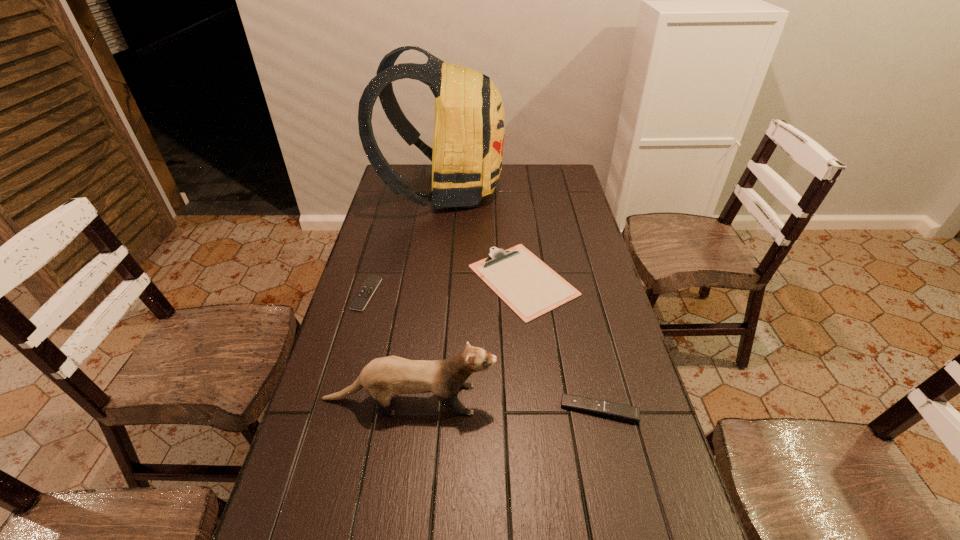
In order to click on vacant space at the far edge of the desktop in this screenshot , I will do `click(524, 187)`.

In the image, there is a desktop. Find the location of `vacant space at the left edge`. vacant space at the left edge is located at coordinates (378, 234).

Where is `blank area at the right edge`? blank area at the right edge is located at coordinates (670, 480).

Where is `vacant space at the far right corner of the desktop`? vacant space at the far right corner of the desktop is located at coordinates (556, 171).

At what (x,y) coordinates should I click in order to perform the action: click on empty space between the clipboard and the ferret. Please return your answer as a coordinate pair (x, y). Looking at the image, I should click on (467, 340).

Find the location of a particular element. This screenshot has height=540, width=960. vacant area that lies between the backpack and the clipboard is located at coordinates (483, 235).

Locate an element on the screen. Image resolution: width=960 pixels, height=540 pixels. vacant space that is in between the farthest object and the clipboard is located at coordinates pos(483,235).

The width and height of the screenshot is (960, 540). In order to click on vacant space in between the farther remote control and the farthest object in this screenshot , I will do `click(404, 242)`.

You are a GUI agent. You are given a task and a screenshot of the screen. Output one action in this format:
    pyautogui.click(x=<x>, y=<y>)
    Task: Click on the vacant area that lies between the shortest object and the clipboard
    This screenshot has height=540, width=960.
    Given the screenshot: What is the action you would take?
    pyautogui.click(x=444, y=287)

Identify the location of vacant area that lies between the clipboard and the ferret. The height and width of the screenshot is (540, 960). (467, 340).